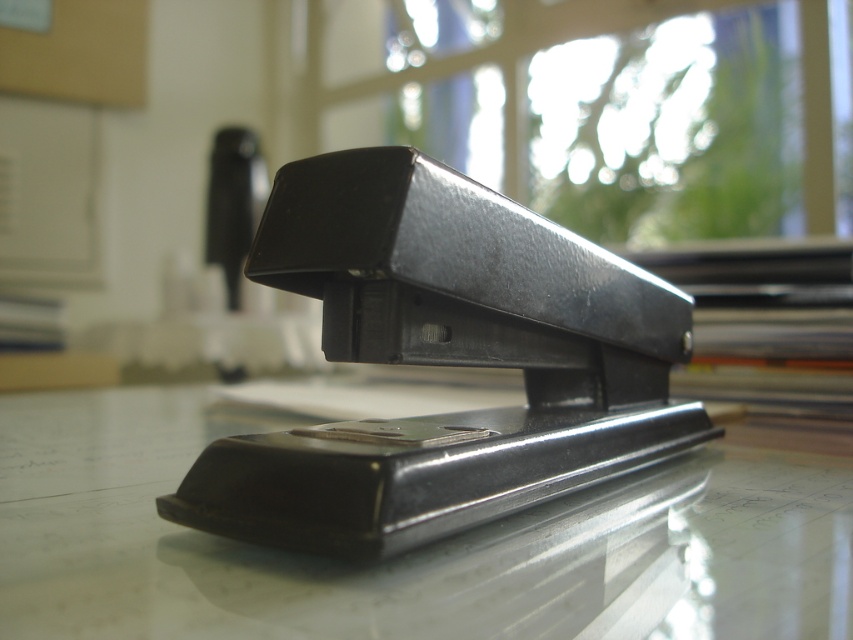
Between black glossy stapler at center and black plastic stapler at center, which one has less height?

black glossy stapler at center is shorter.

Measure the distance between black glossy stapler at center and camera.

black glossy stapler at center is 36.54 centimeters away from camera.

Find the location of a particular element. black glossy stapler at center is located at coordinates (405, 554).